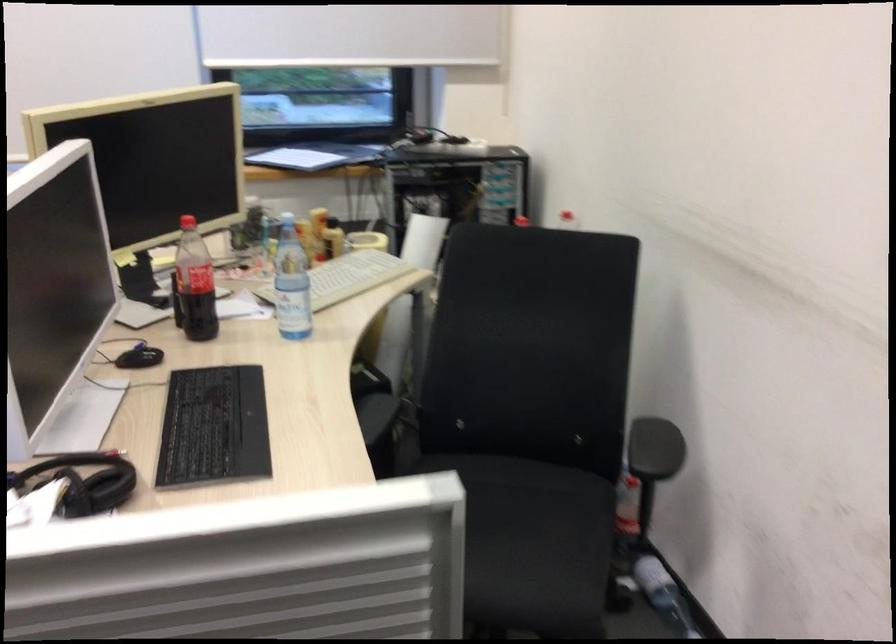
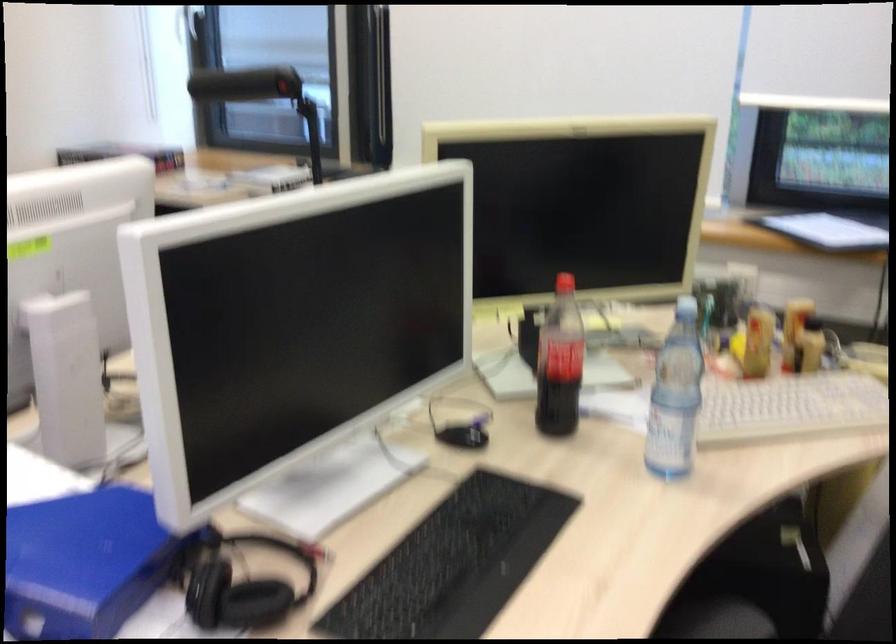
Question: The camera is either moving clockwise (left) or counter-clockwise (right) around the object. The first image is from the beginning of the video and the second image is from the end. Is the camera moving left or right when shooting the video?

Choices:
 (A) Left
 (B) Right

Answer: (B)